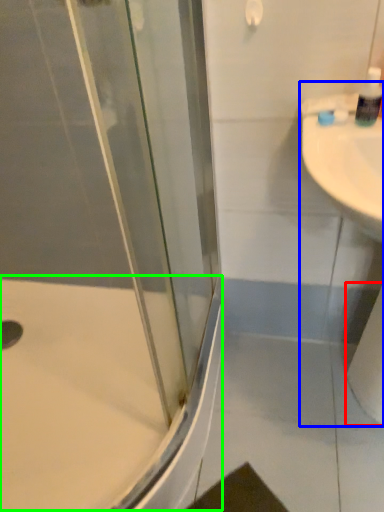
Question: Considering the real-world distances, which object is closest to toilet paper (highlighted by a red box)? sink (highlighted by a blue box) or bath (highlighted by a green box).

Choices:
 (A) sink
 (B) bath

Answer: (A)